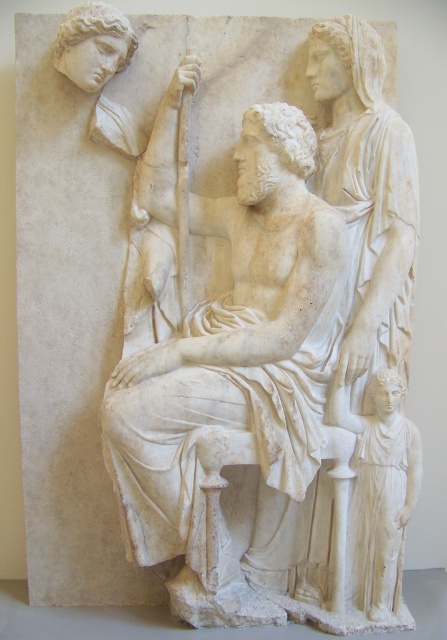
Based on the provided scene description, where is the white marble statue at center located in terms of coordinates?

The white marble statue at center is located at point (x=240, y=385).

You are an art conservator examining the classical marble relief sculpture. You need to move the white marble statue at center and the white marble statue at lower right to a new display area. Based on their positions in the original image, which statue is located more to the left?

The white marble statue at center is positioned on the left side of the white marble statue at lower right, so the white marble statue at center is more to the left.